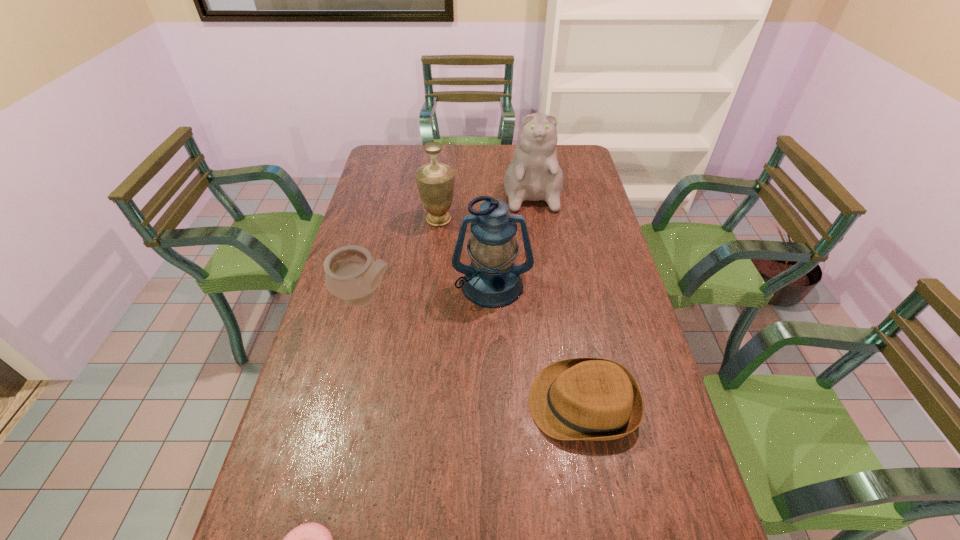
Find the location of a particular element. This screenshot has height=540, width=960. object that stands as the fifth closest to the lantern is located at coordinates 310,539.

Identify the location of object identified as the third closest to the cat. The width and height of the screenshot is (960, 540). (352, 274).